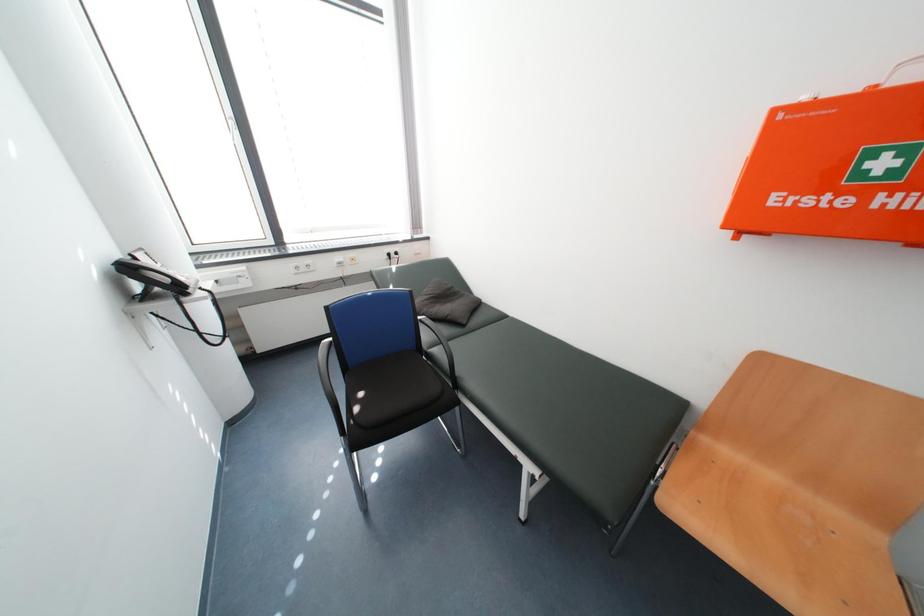
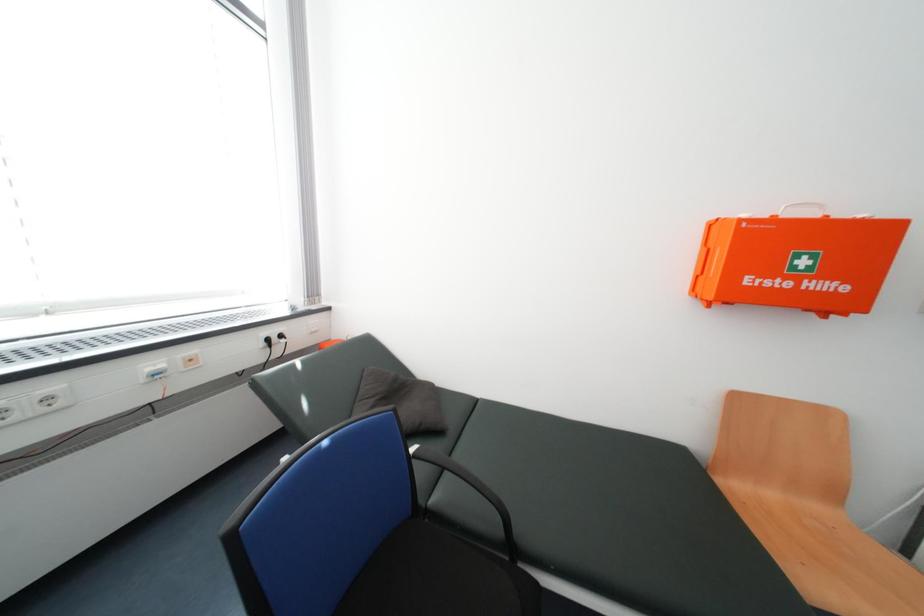
Question: The camera is either moving clockwise (left) or counter-clockwise (right) around the object. The first image is from the beginning of the video and the second image is from the end. Is the camera moving left or right when shooting the video?

Choices:
 (A) Left
 (B) Right

Answer: (A)